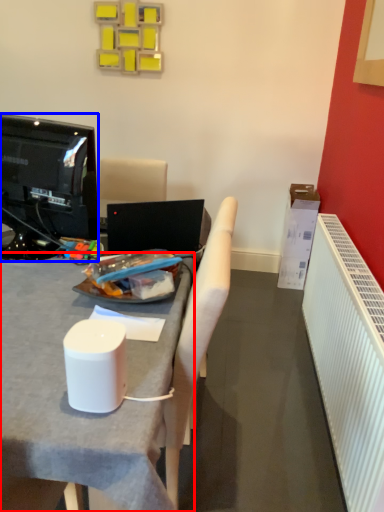
Question: Which point is further to the camera, desk (highlighted by a red box) or television (highlighted by a blue box)?

Choices:
 (A) desk
 (B) television

Answer: (B)